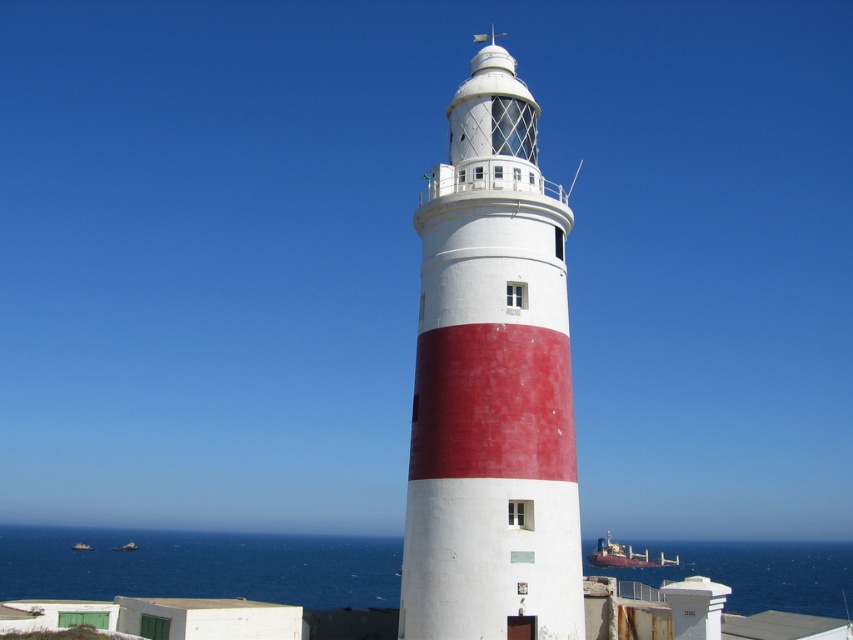
Is point (62, 563) farther from camera compared to point (73, 547)?

No, it is not.

How far apart are blue water at lower center and metallic gray ship at lower left?

They are 189.93 feet apart.

Does point (337, 573) come in front of point (88, 547)?

Yes, point (337, 573) is in front of point (88, 547).

At what (x,y) coordinates should I click in order to perform the action: click on blue water at lower center. Please return your answer as a coordinate pair (x, y). The height and width of the screenshot is (640, 853). Looking at the image, I should click on (199, 566).

Is white painted lighthouse at center further to camera compared to blue water at lower center?

That is False.

Is point (550, 563) positioned after point (717, 557)?

No.

Locate an element on the screen. white painted lighthouse at center is located at coordinates (491, 385).

Does blue water at lower center have a smaller size compared to metallic gray boat at lower left?

No, blue water at lower center is not smaller than metallic gray boat at lower left.

In the scene shown: Which of these two, blue water at lower center or metallic gray boat at lower left, stands shorter?

With less height is metallic gray boat at lower left.

Who is more distant from viewer, (397,593) or (125,547)?

The point (125,547) is more distant.

This screenshot has width=853, height=640. In order to click on blue water at lower center in this screenshot , I will do `click(199, 566)`.